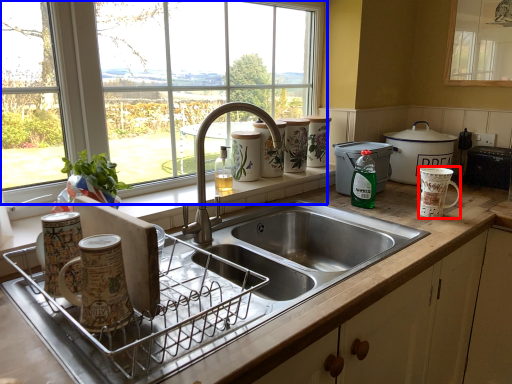
Question: Among these objects, which one is nearest to the camera, mug (highlighted by a red box) or window (highlighted by a blue box)?

Choices:
 (A) mug
 (B) window

Answer: (B)